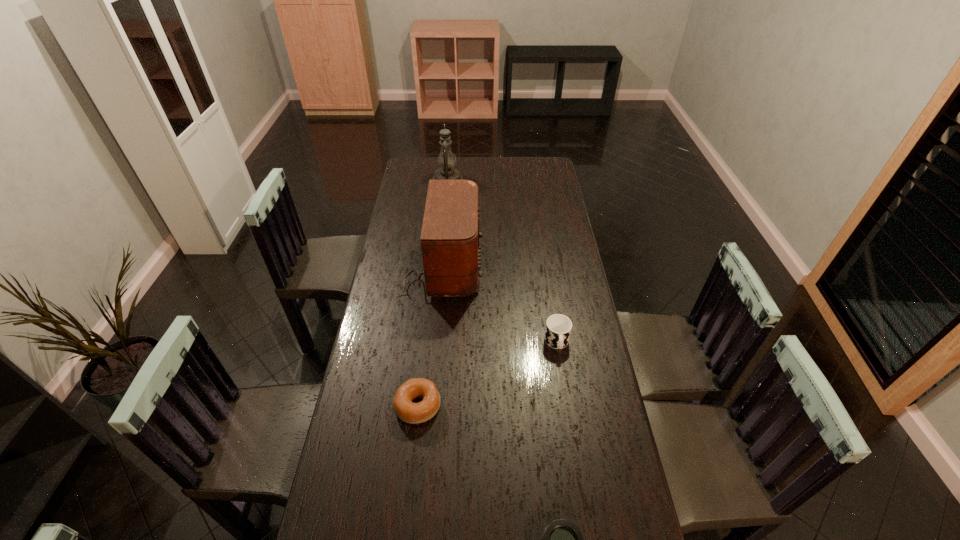
Identify the location of free space located 0.290m on the face of the farthest sunflower. (492, 168).

You are a GUI agent. You are given a task and a screenshot of the screen. Output one action in this format:
    pyautogui.click(x=<x>, y=<y>)
    Task: Click on the vacant space located 0.370m on the front label of the carton
    The image size is (960, 540).
    Given the screenshot: What is the action you would take?
    pos(466,169)

You are a GUI agent. You are given a task and a screenshot of the screen. Output one action in this format:
    pyautogui.click(x=<x>, y=<y>)
    Task: Click on the free location located 0.150m on the front label of the carton
    
    Given the screenshot: What is the action you would take?
    pyautogui.click(x=508, y=169)

At what (x,y) coordinates should I click in order to perform the action: click on vacant space located 0.170m on the front label of the carton. Please return your answer as a coordinate pair (x, y). This screenshot has width=960, height=540. Looking at the image, I should click on (504, 169).

Identify the location of blank space located 0.120m on the front-facing side of the second smallest yellow sunflower. This screenshot has height=540, width=960. (494, 315).

Locate an element on the screen. free space located 0.380m on the front-facing side of the second smallest yellow sunflower is located at coordinates (422, 315).

Find the location of a particular element. vacant area located 0.140m on the front-facing side of the second smallest yellow sunflower is located at coordinates (490, 315).

You are a GUI agent. You are given a task and a screenshot of the screen. Output one action in this format:
    pyautogui.click(x=<x>, y=<y>)
    Task: Click on the vacant area situated on the face of the second nearest green sunflower
    The image size is (960, 540).
    Given the screenshot: What is the action you would take?
    pyautogui.click(x=492, y=353)

You are a GUI agent. You are given a task and a screenshot of the screen. Output one action in this format:
    pyautogui.click(x=<x>, y=<y>)
    Task: Click on the vacant space situated 0.110m on the front-facing side of the smallest yellow sunflower
    This screenshot has height=540, width=960.
    Given the screenshot: What is the action you would take?
    pyautogui.click(x=520, y=226)

This screenshot has height=540, width=960. What are the coordinates of `free location located 0.090m on the front-facing side of the smallest yellow sunflower` in the screenshot? It's located at [x=525, y=226].